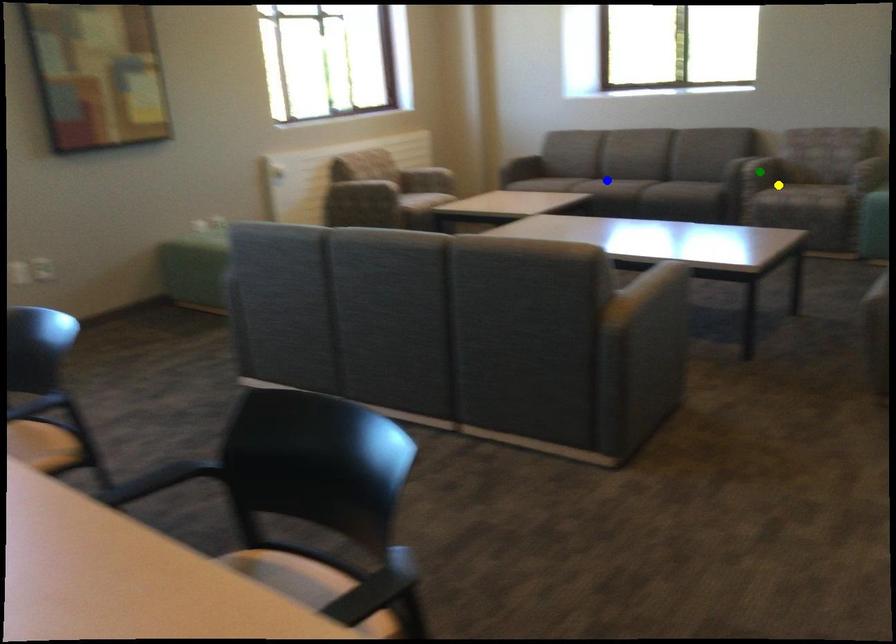
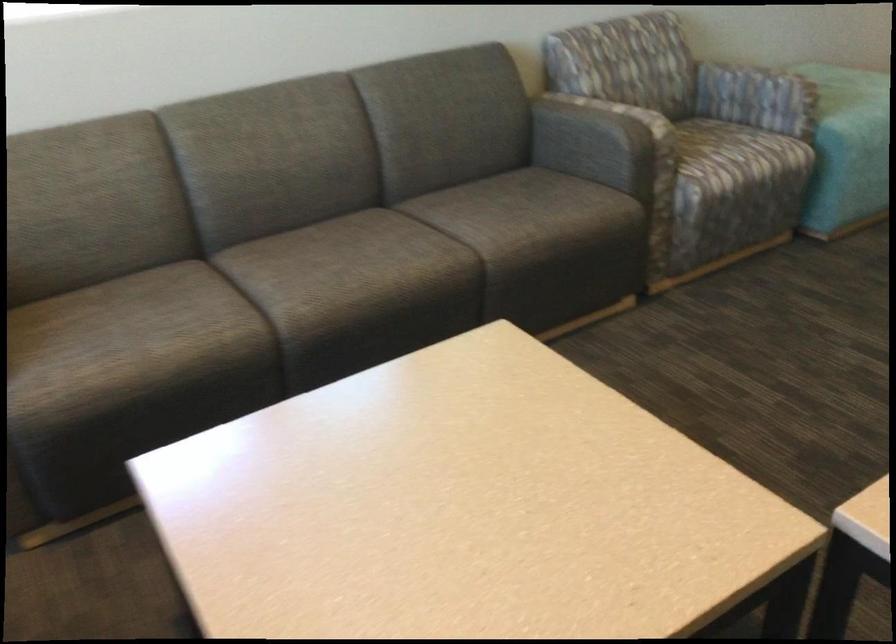
I am providing you with two images of the same scene from different viewpoints. Three points are marked in image1. Which point corresponds to a part or object that is occluded in image2?In image1, three points are marked. Which of them correspond to a part or object that is occluded in image2?Among the three points shown in image1, which one corresponds to a part or object that is no longer visible due to occlusion in image2?

green point